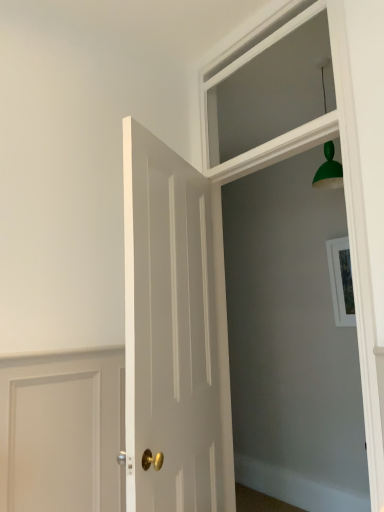
Question: Can you confirm if white wood frame at upper center is smaller than clear glass window at upper center?

Choices:
 (A) no
 (B) yes

Answer: (A)

Question: Is white wood frame at upper center shorter than clear glass window at upper center?

Choices:
 (A) no
 (B) yes

Answer: (A)

Question: Is the position of white wood frame at upper center more distant than that of clear glass window at upper center?

Choices:
 (A) no
 (B) yes

Answer: (A)

Question: From the image's perspective, does white wood frame at upper center appear higher than clear glass window at upper center?

Choices:
 (A) yes
 (B) no

Answer: (B)

Question: Can you confirm if white wood frame at upper center is positioned to the left of clear glass window at upper center?

Choices:
 (A) yes
 (B) no

Answer: (B)

Question: Is clear glass window at upper center inside or outside of white wood frame at upper center?

Choices:
 (A) outside
 (B) inside

Answer: (A)

Question: From the image's perspective, is clear glass window at upper center located above or below white wood frame at upper center?

Choices:
 (A) below
 (B) above

Answer: (B)

Question: Based on their sizes in the image, would you say clear glass window at upper center is bigger or smaller than white wood frame at upper center?

Choices:
 (A) small
 (B) big

Answer: (A)

Question: Considering the positions of clear glass window at upper center and white wood frame at upper center in the image, is clear glass window at upper center taller or shorter than white wood frame at upper center?

Choices:
 (A) tall
 (B) short

Answer: (B)

Question: From the image's perspective, is white glossy door at center located above or below clear glass window at upper center?

Choices:
 (A) below
 (B) above

Answer: (A)

Question: Is white glossy door at center in front of or behind clear glass window at upper center in the image?

Choices:
 (A) behind
 (B) front

Answer: (B)

Question: Is point (178, 508) closer or farther from the camera than point (309, 118)?

Choices:
 (A) farther
 (B) closer

Answer: (B)

Question: Which is correct: white glossy door at center is inside clear glass window at upper center, or outside of it?

Choices:
 (A) inside
 (B) outside

Answer: (B)

Question: Looking at their shapes, would you say clear glass window at upper center is wider or thinner than white glossy door at center?

Choices:
 (A) wide
 (B) thin

Answer: (B)

Question: Choose the correct answer: Is clear glass window at upper center inside white glossy door at center or outside it?

Choices:
 (A) outside
 (B) inside

Answer: (A)